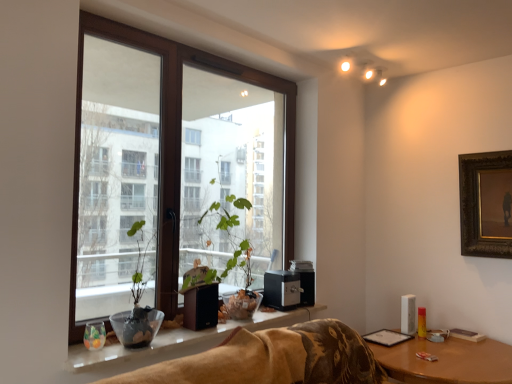
The width and height of the screenshot is (512, 384). I want to click on empty space that is ontop of brown wooden window at center (from a real-world perspective), so click(x=203, y=43).